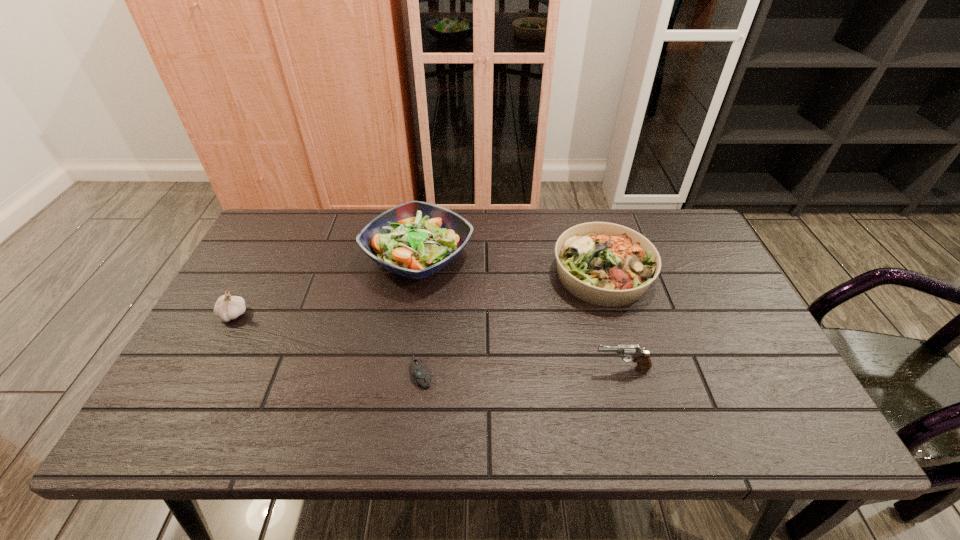
Where is `free space between the right salad plate and the pistol`? The height and width of the screenshot is (540, 960). free space between the right salad plate and the pistol is located at coordinates (612, 321).

In order to click on free spot between the taller salad plate and the shortest object in this screenshot , I will do `click(420, 314)`.

Locate an element on the screen. vacant space in between the shorter salad plate and the shortest object is located at coordinates (512, 323).

This screenshot has width=960, height=540. I want to click on vacant area between the garlic and the shorter salad plate, so click(418, 294).

The width and height of the screenshot is (960, 540). I want to click on free spot between the shorter salad plate and the computer mouse, so click(512, 323).

Locate an element on the screen. The width and height of the screenshot is (960, 540). empty space between the tallest object and the pistol is located at coordinates (520, 312).

At what (x,y) coordinates should I click in order to perform the action: click on free spot between the pistol and the garlic. Please return your answer as a coordinate pair (x, y). This screenshot has width=960, height=540. Looking at the image, I should click on (427, 341).

You are a GUI agent. You are given a task and a screenshot of the screen. Output one action in this format:
    pyautogui.click(x=<x>, y=<y>)
    Task: Click on the unoccupied position between the tallest object and the computer mouse
    This screenshot has height=540, width=960.
    Given the screenshot: What is the action you would take?
    pyautogui.click(x=420, y=314)

The width and height of the screenshot is (960, 540). Identify the location of unoccupied position between the pistol and the tallest object. (520, 312).

At what (x,y) coordinates should I click in order to perform the action: click on object that can be found as the third closest to the garlic. Please return your answer as a coordinate pair (x, y). This screenshot has height=540, width=960. Looking at the image, I should click on (606, 264).